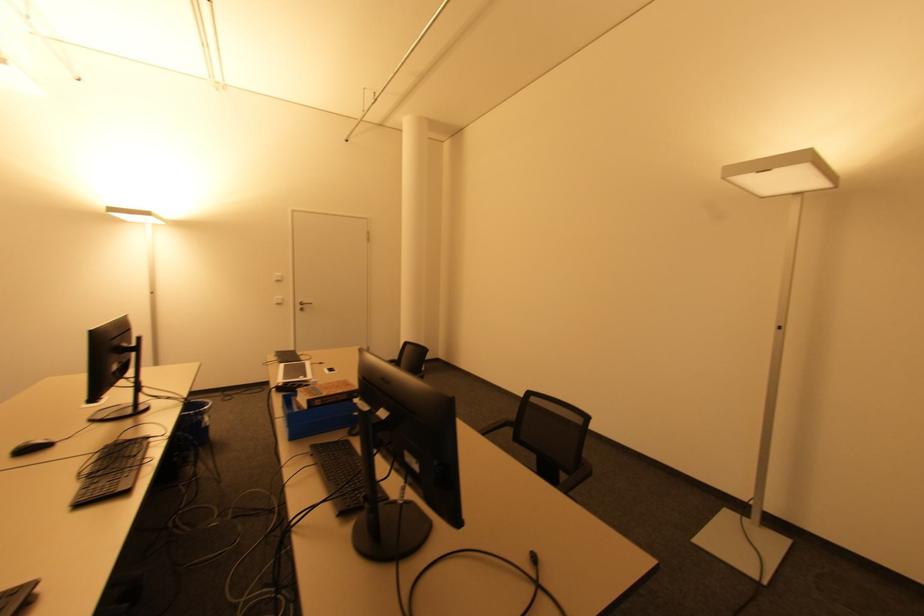
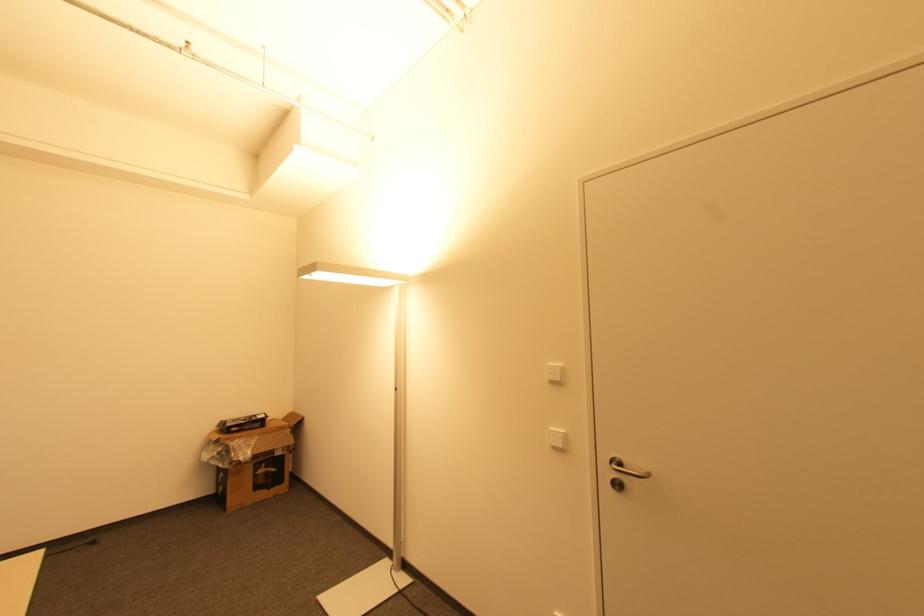
Where in the second image is the point corresponding to (x=280, y=304) from the first image?

(557, 448)